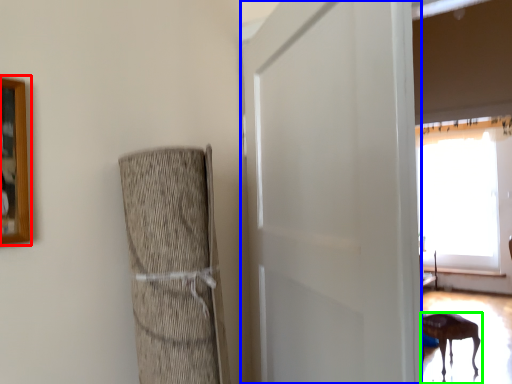
Question: Based on their relative distances, which object is nearer to picture frame (highlighted by a red box)? Choose from screen door (highlighted by a blue box) and furniture (highlighted by a green box).

Choices:
 (A) screen door
 (B) furniture

Answer: (A)